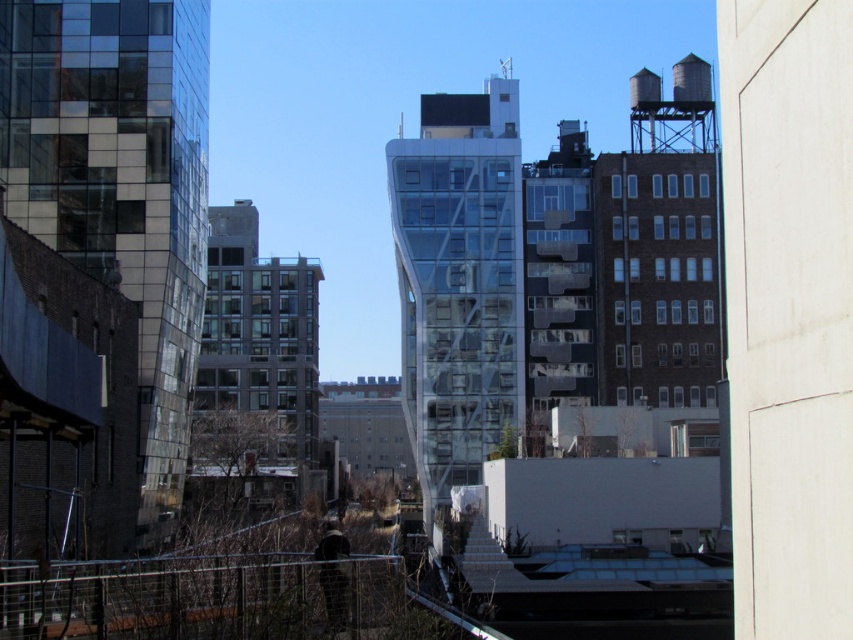
Does metallic water tower at center have a lesser height compared to metallic wire fence at lower center?

In fact, metallic water tower at center may be taller than metallic wire fence at lower center.

Does metallic water tower at center appear on the left side of metallic wire fence at lower center?

No, metallic water tower at center is not to the left of metallic wire fence at lower center.

Who is more forward, (506, 257) or (143, 614)?

Point (143, 614) is more forward.

Where is `metallic water tower at center`? Image resolution: width=853 pixels, height=640 pixels. metallic water tower at center is located at coordinates (459, 282).